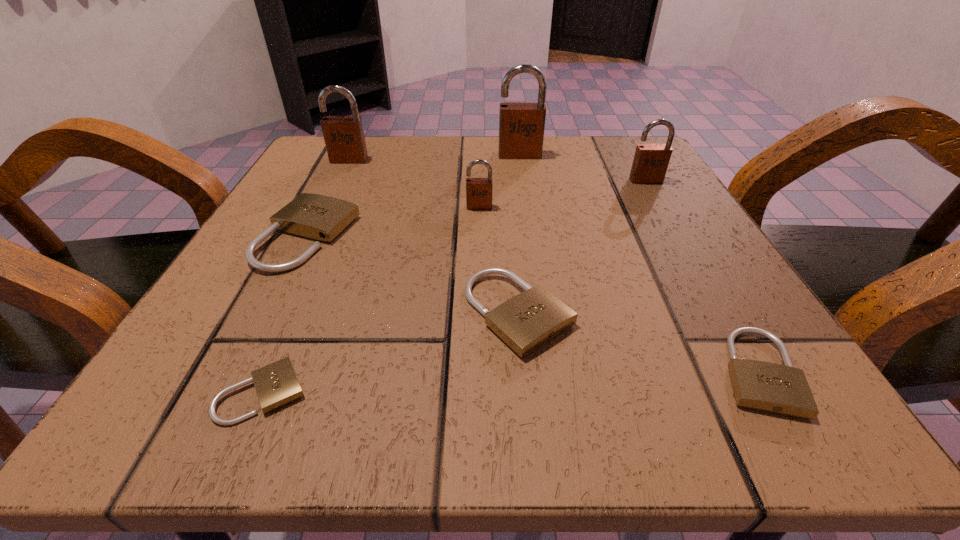
Identify the location of vacant space at the left edge. (245, 254).

This screenshot has height=540, width=960. In the image, there is a desktop. What are the coordinates of `free space at the right edge` in the screenshot? It's located at (737, 350).

The image size is (960, 540). What are the coordinates of `free space at the far left corner of the desktop` in the screenshot? It's located at (340, 183).

In the image, there is a desktop. Identify the location of free space at the near left corner. Image resolution: width=960 pixels, height=540 pixels. (226, 410).

The image size is (960, 540). I want to click on free location at the far right corner of the desktop, so click(649, 186).

Identify the location of vacant space that is in between the rightmost beige padlock and the shortest padlock. Image resolution: width=960 pixels, height=540 pixels. (510, 382).

You are a GUI agent. You are given a task and a screenshot of the screen. Output one action in this format:
    pyautogui.click(x=<x>, y=<y>)
    Task: Click on the vacant space that's between the third shortest padlock and the second tallest padlock
    The height and width of the screenshot is (540, 960).
    Given the screenshot: What is the action you would take?
    pyautogui.click(x=434, y=237)

You are a GUI agent. You are given a task and a screenshot of the screen. Output one action in this format:
    pyautogui.click(x=<x>, y=<y>)
    Task: Click on the free spot between the second smallest beige padlock and the smallest brown padlock
    The width and height of the screenshot is (960, 540).
    Given the screenshot: What is the action you would take?
    pyautogui.click(x=618, y=289)

Where is `vacant point located between the second shortest object and the shortest object`? The width and height of the screenshot is (960, 540). vacant point located between the second shortest object and the shortest object is located at coordinates (510, 382).

Locate an element on the screen. The width and height of the screenshot is (960, 540). free space between the shortest padlock and the seventh tallest object is located at coordinates (510, 382).